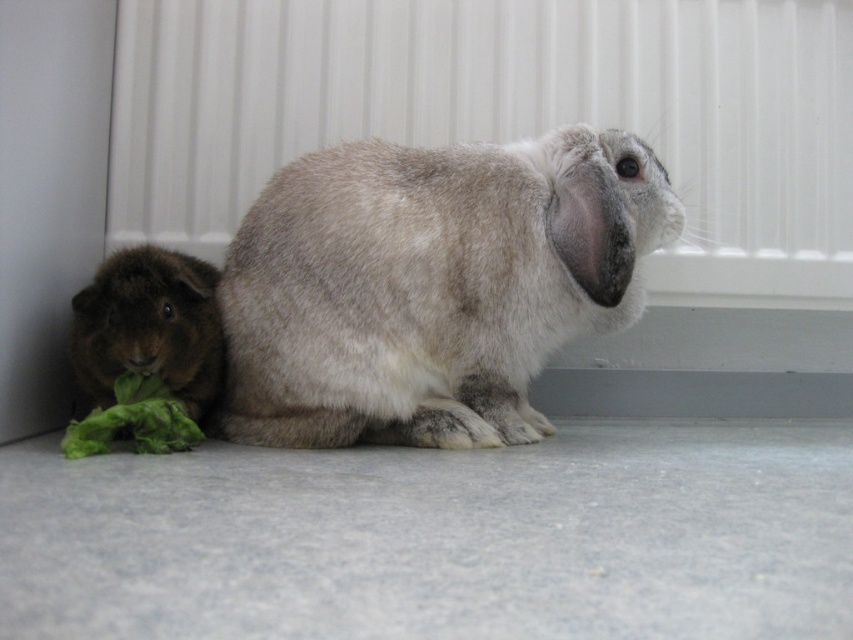
In the scene shown: Is fuzzy gray rabbit at center positioned at the back of brown fuzzy guinea pig at lower left?

Yes, it is behind brown fuzzy guinea pig at lower left.

Is fuzzy gray rabbit at center below brown fuzzy guinea pig at lower left?

Actually, fuzzy gray rabbit at center is above brown fuzzy guinea pig at lower left.

Is point (405, 312) closer to camera compared to point (190, 308)?

No, (405, 312) is behind (190, 308).

Find the location of a particular element. fuzzy gray rabbit at center is located at coordinates (430, 285).